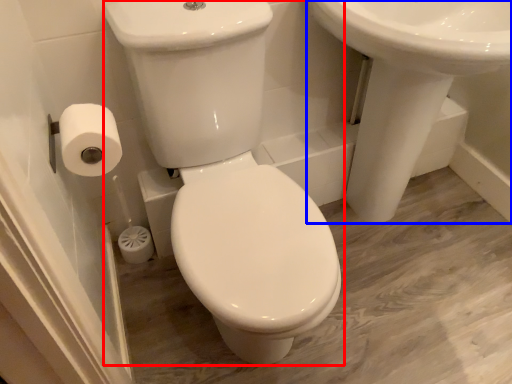
Question: Which point is closer to the camera, porcelain (highlighted by a red box) or sink (highlighted by a blue box)?

Choices:
 (A) porcelain
 (B) sink

Answer: (A)